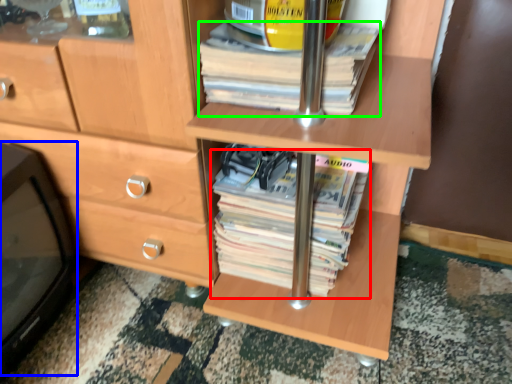
Question: Which object is positioned closest to paperback book (highlighted by a red box)? Select from desktop (highlighted by a blue box) and paperback book (highlighted by a green box).

Choices:
 (A) desktop
 (B) paperback book

Answer: (B)